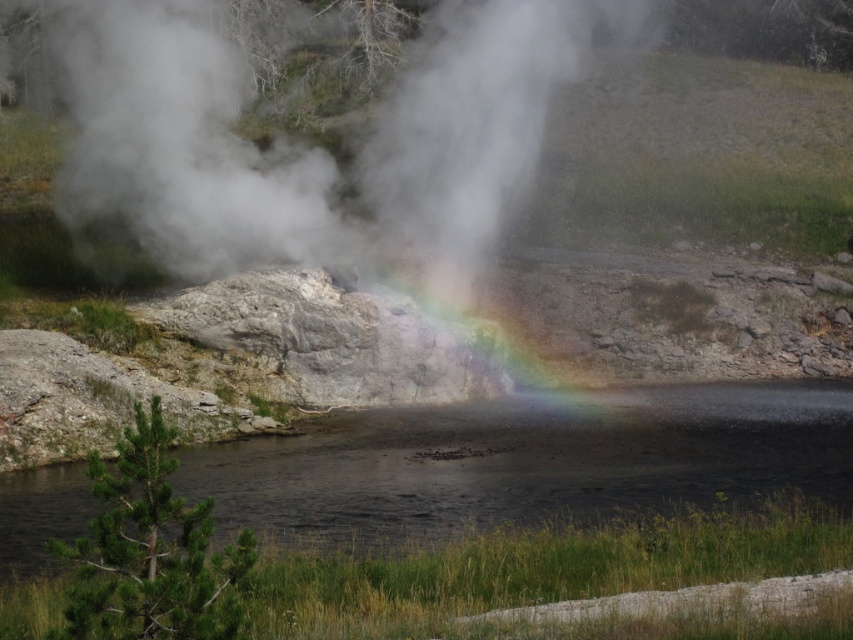
Does white vapor at center lie in front of transparent water at center?

No, white vapor at center is behind transparent water at center.

Does white vapor at center have a larger size compared to transparent water at center?

Yes.

Between point (90, 214) and point (187, 477), which one is positioned in front?

Point (187, 477) is more forward.

In order to click on white vapor at center in this screenshot , I will do `click(311, 147)`.